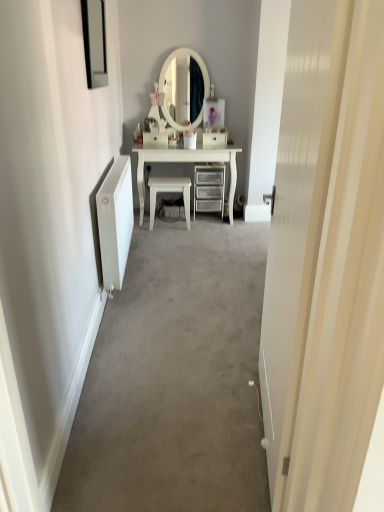
Identify the location of blank space to the left of white wood door at center. Image resolution: width=384 pixels, height=512 pixels. (185, 432).